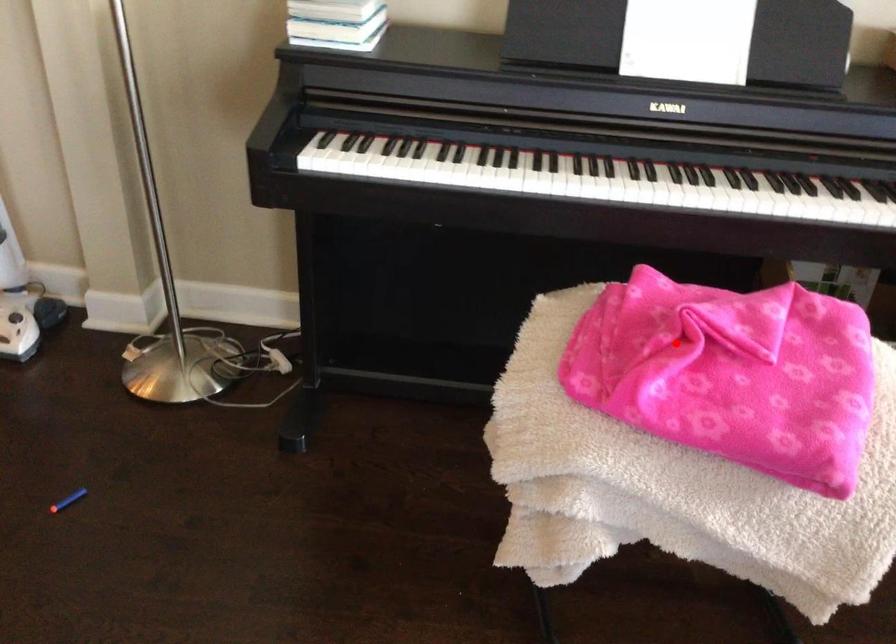
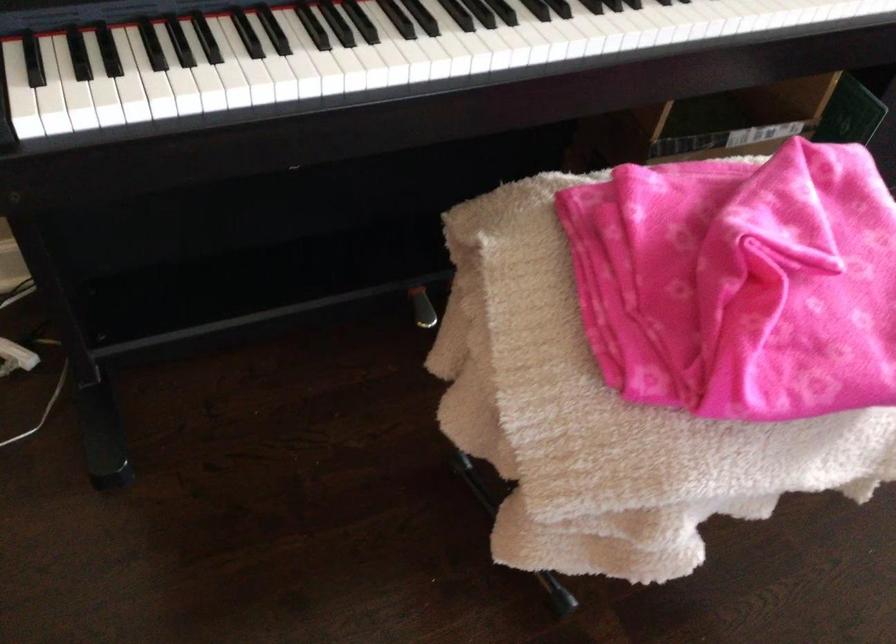
Find the pixel in the second image that matches the highlighted location in the first image.

(739, 283)